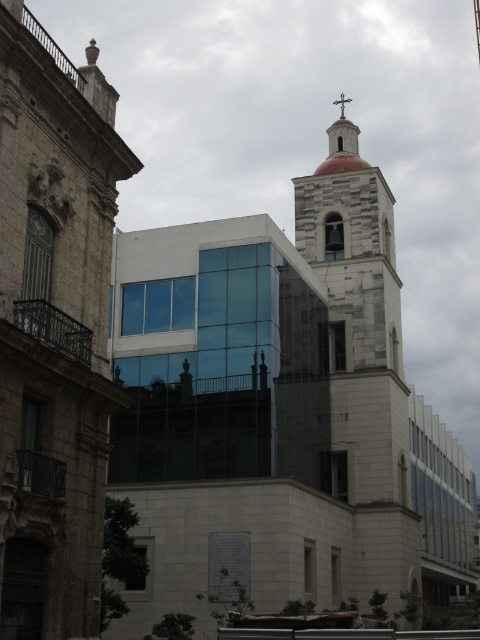
You are an architect analyzing the building facade. Which object, the white stone church at center or the green metallic cross at upper center, occupies more visual space in the composition?

The white stone church at center has a larger size compared to the green metallic cross at upper center, so it occupies more visual space in the composition.

You are standing in front of the building and want to determine the distance between two points marked on the structure. The points are labeled as point (81, 228) and point (342, 109). Which point is nearer to you?

Point (81, 228) is closer to the viewer than point (342, 109).

You are standing in the modern glass building and looking out through the large glass panels. There is a point marked at coordinates (54,326) on the glass. What object is located at that point in the reflection?

The point at (54,326) marks the white stone church at center, which is reflected in the glass panels.